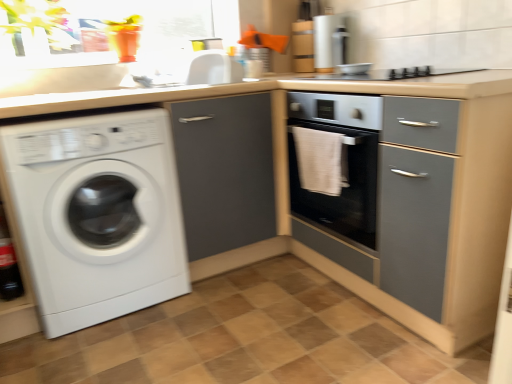
Question: Should I look upward or downward to see white glossy sink at upper center?

Choices:
 (A) down
 (B) up

Answer: (B)

Question: From a real-world perspective, is white glossy washing machine at left on matte gray cabinet at center?

Choices:
 (A) yes
 (B) no

Answer: (A)

Question: Considering the relative sizes of white glossy washing machine at left and matte gray cabinet at center in the image provided, is white glossy washing machine at left thinner than matte gray cabinet at center?

Choices:
 (A) no
 (B) yes

Answer: (A)

Question: From a real-world perspective, is white glossy washing machine at left under matte gray cabinet at center?

Choices:
 (A) no
 (B) yes

Answer: (A)

Question: Is white glossy washing machine at left aimed at matte gray cabinet at center?

Choices:
 (A) no
 (B) yes

Answer: (A)

Question: Considering the relative positions of white glossy washing machine at left and matte gray cabinet at center in the image provided, is white glossy washing machine at left to the right of matte gray cabinet at center from the viewer's perspective?

Choices:
 (A) yes
 (B) no

Answer: (B)

Question: Is white glossy washing machine at left taller than matte gray cabinet at center?

Choices:
 (A) no
 (B) yes

Answer: (A)

Question: From a real-world perspective, is white towel at center positioned under metallic silver bowl at upper center based on gravity?

Choices:
 (A) yes
 (B) no

Answer: (A)

Question: Is white towel at center further to the viewer compared to metallic silver bowl at upper center?

Choices:
 (A) yes
 (B) no

Answer: (B)

Question: Considering the relative sizes of white towel at center and metallic silver bowl at upper center in the image provided, is white towel at center bigger than metallic silver bowl at upper center?

Choices:
 (A) no
 (B) yes

Answer: (B)

Question: From a real-world perspective, is white towel at center over metallic silver bowl at upper center?

Choices:
 (A) no
 (B) yes

Answer: (A)

Question: Is white towel at center at the right side of metallic silver bowl at upper center?

Choices:
 (A) no
 (B) yes

Answer: (A)

Question: Does white towel at center have a greater height compared to metallic silver bowl at upper center?

Choices:
 (A) yes
 (B) no

Answer: (A)

Question: Does matte gray cabinet at center turn towards white glossy washing machine at left?

Choices:
 (A) no
 (B) yes

Answer: (A)